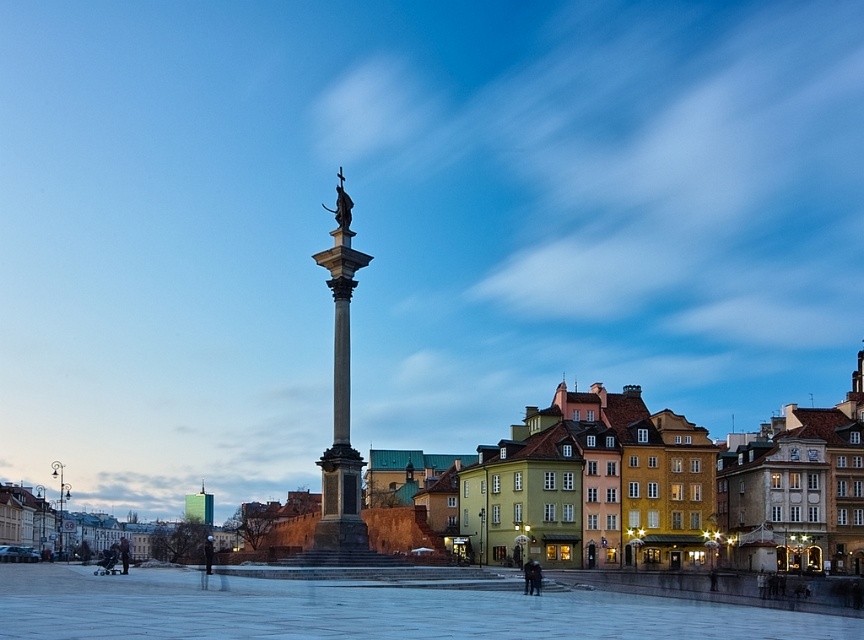
Is polished stone column at center to the left of polished bronze statue at center from the viewer's perspective?

In fact, polished stone column at center is to the right of polished bronze statue at center.

Is polished stone column at center positioned in front of polished bronze statue at center?

Yes, polished stone column at center is closer to the viewer.

Which is behind, point (328, 536) or point (335, 209)?

Point (335, 209)

Locate an element on the screen. The width and height of the screenshot is (864, 640). polished stone column at center is located at coordinates (340, 400).